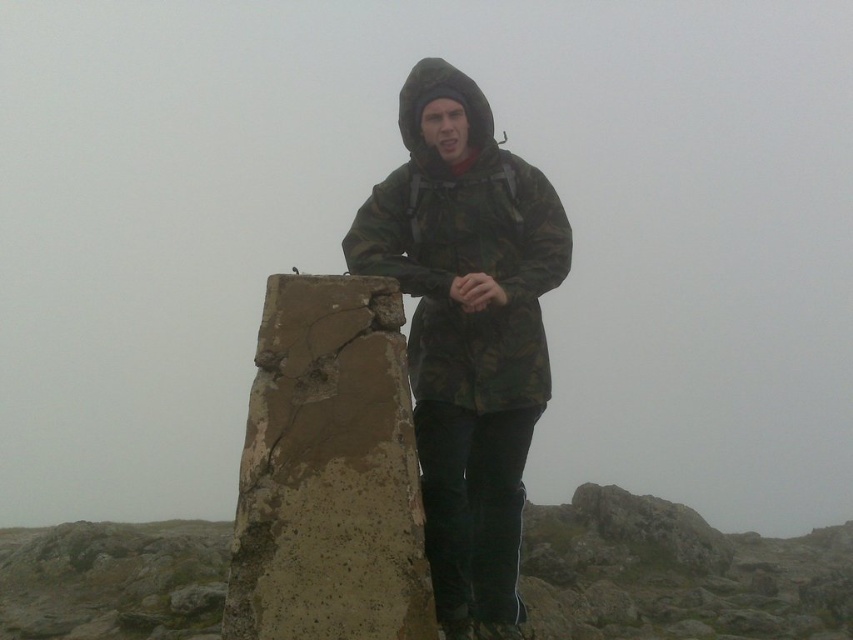
Can you confirm if brown concrete block at center is bigger than camo fabric jacket at center?

Incorrect, brown concrete block at center is not larger than camo fabric jacket at center.

Is point (399, 506) closer to viewer compared to point (473, 396)?

Yes.

The height and width of the screenshot is (640, 853). Identify the location of brown concrete block at center. (329, 472).